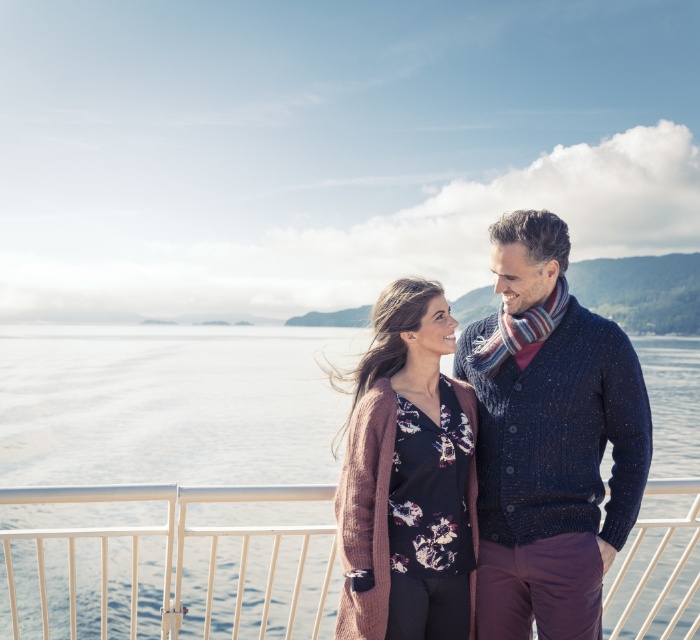
Question: Considering the real-world distances, which object is closest to the knitted navy sweater at center?

Choices:
 (A) clear water at center
 (B) rustic knit cardigan at center

Answer: (B)

Question: From the image, what is the correct spatial relationship of knitted navy sweater at center in relation to rustic knit cardigan at center?

Choices:
 (A) right
 (B) left

Answer: (A)

Question: Which of the following is the farthest from the observer?

Choices:
 (A) clear water at center
 (B) rustic knit cardigan at center

Answer: (A)

Question: Which of the following is the farthest from the observer?

Choices:
 (A) (463, 561)
 (B) (483, 477)

Answer: (B)

Question: Does clear water at center lie in front of knitted navy sweater at center?

Choices:
 (A) no
 (B) yes

Answer: (A)

Question: Does knitted navy sweater at center come behind rustic knit cardigan at center?

Choices:
 (A) yes
 (B) no

Answer: (A)